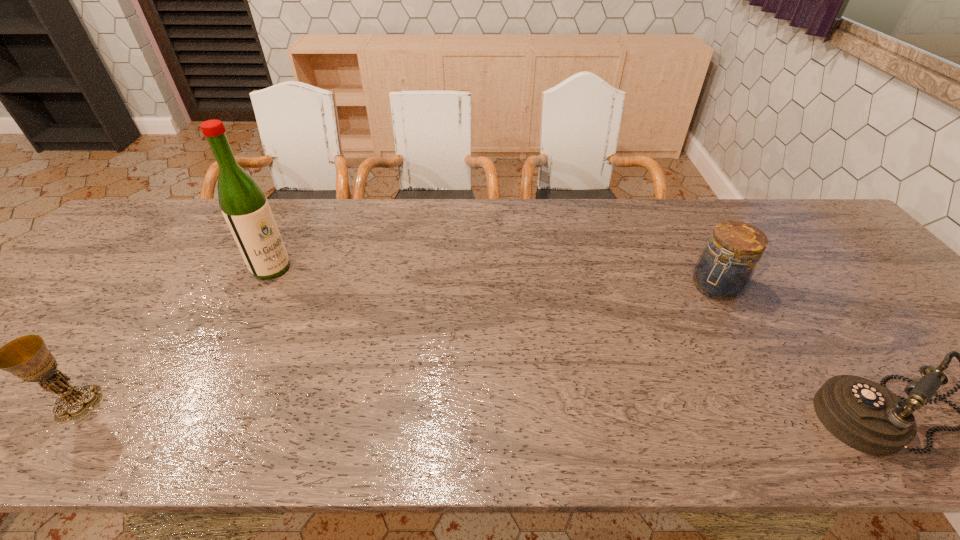
Find the location of a particular element. free spot on the desktop that is between the leftmost object and the telephone and is positioned on the lid of the jar is located at coordinates (601, 411).

This screenshot has width=960, height=540. Find the location of `free space on the desktop that is between the chalice and the telephone and is positioned on the label of the tallest object`. free space on the desktop that is between the chalice and the telephone and is positioned on the label of the tallest object is located at coordinates point(516,410).